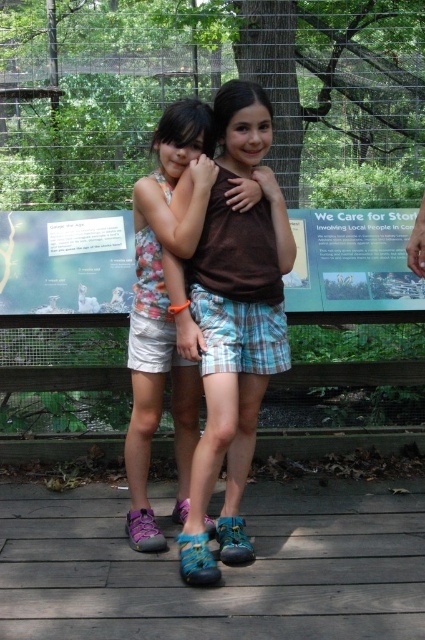
Is brown cotton shirt at center behind floral fabric dress at center?

No.

Is brown cotton shirt at center thinner than floral fabric dress at center?

No.

Identify the location of brown cotton shirt at center. (232, 323).